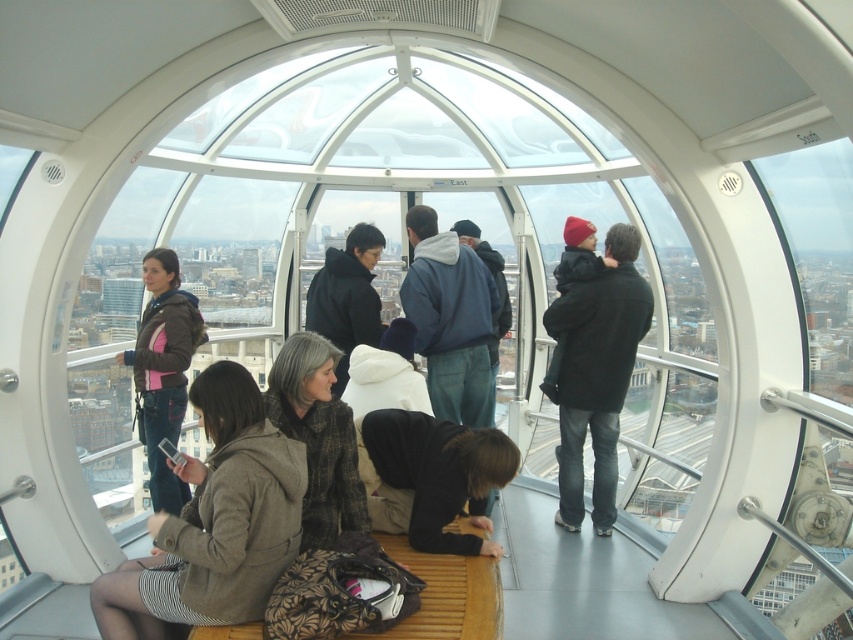
Does dark brown leather jacket at lower center have a greater width compared to brown textured coat at center?

Indeed, dark brown leather jacket at lower center has a greater width compared to brown textured coat at center.

Between dark brown leather jacket at lower center and brown textured coat at center, which one has more height?

With more height is brown textured coat at center.

Find the location of a particular element. dark brown leather jacket at lower center is located at coordinates (439, 474).

Where is `dark brown leather jacket at lower center`? The height and width of the screenshot is (640, 853). dark brown leather jacket at lower center is located at coordinates (439, 474).

Is point (547, 212) closer to camera compared to point (305, 358)?

No, (547, 212) is behind (305, 358).

Can you confirm if transparent glass window at center is positioned to the right of brown textured coat at center?

In fact, transparent glass window at center is to the left of brown textured coat at center.

Where is `transparent glass window at center`? This screenshot has height=640, width=853. transparent glass window at center is located at coordinates (384, 234).

I want to click on transparent glass window at center, so click(384, 234).

Describe the element at coordinates (450, 320) in the screenshot. I see `blue fleece jacket at center` at that location.

Between blue fleece jacket at center and brown textured coat at center, which one has more height?

Standing taller between the two is blue fleece jacket at center.

Find the location of a particular element. blue fleece jacket at center is located at coordinates (450, 320).